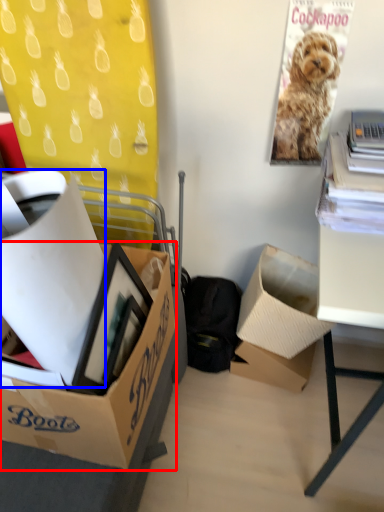
Question: Among these objects, which one is farthest to the camera, box (highlighted by a red box) or box (highlighted by a blue box)?

Choices:
 (A) box
 (B) box

Answer: (A)